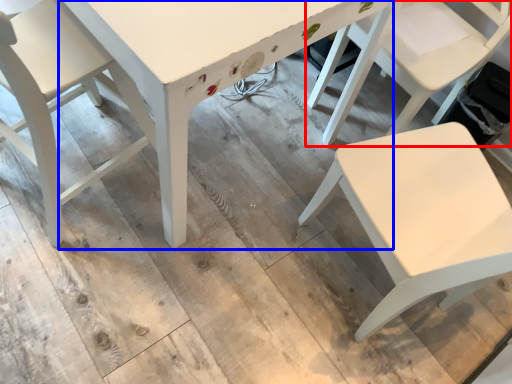
Question: Among these objects, which one is nearest to the camera, chair (highlighted by a red box) or table (highlighted by a blue box)?

Choices:
 (A) chair
 (B) table

Answer: (B)